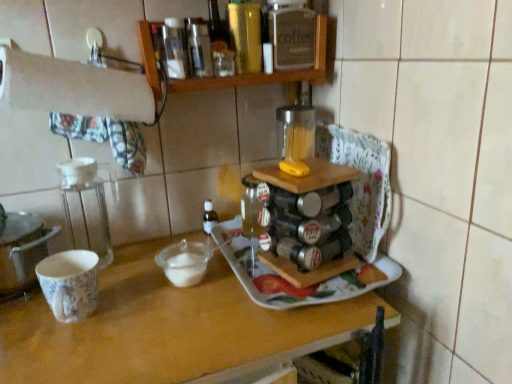
Find the location of `free space that is to the left of transparent glass mixing bowl at center`. free space that is to the left of transparent glass mixing bowl at center is located at coordinates (124, 279).